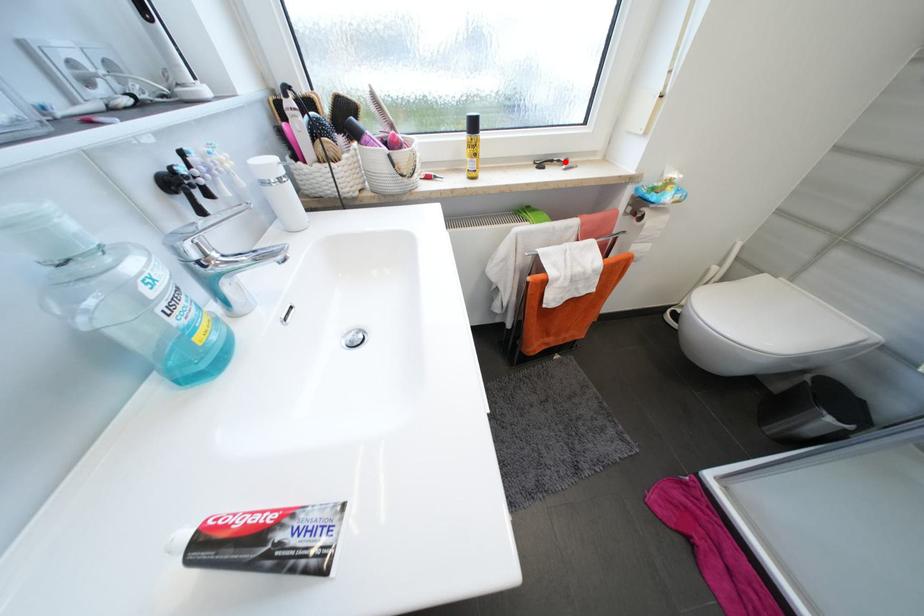
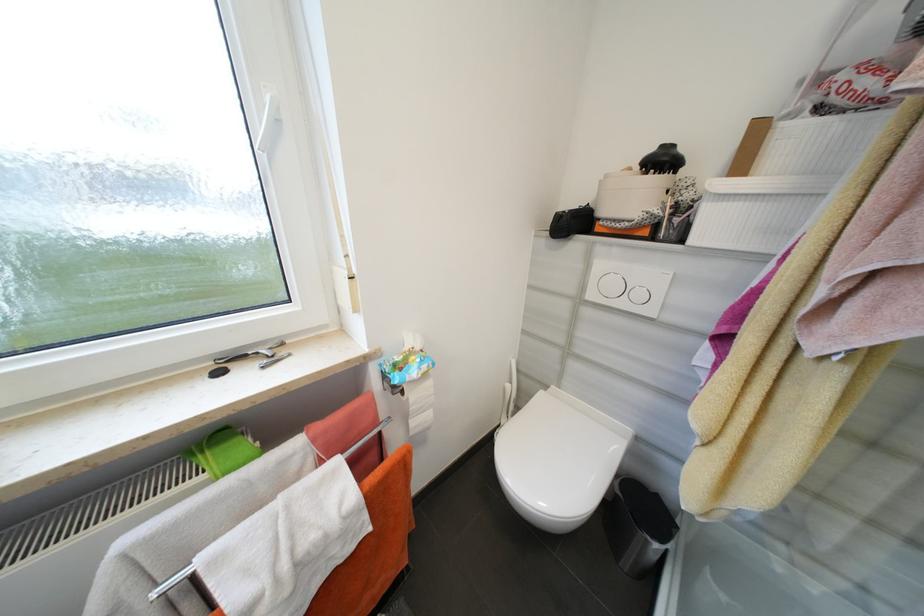
Question: I am providing you with two images of the same scene from different viewpoints. A red point is marked on the first image. Can you still see the location of the red point in image 2?

Choices:
 (A) Yes
 (B) No

Answer: (A)